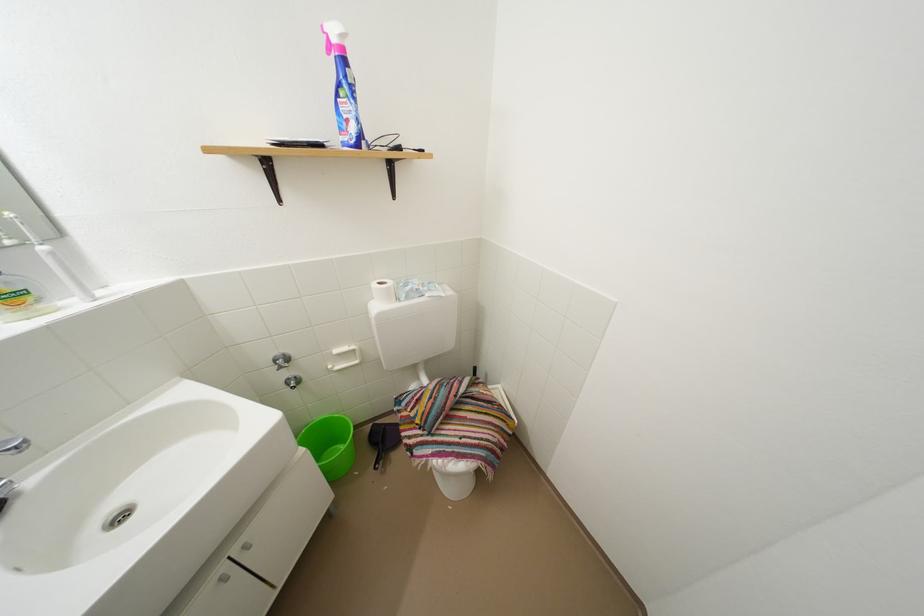
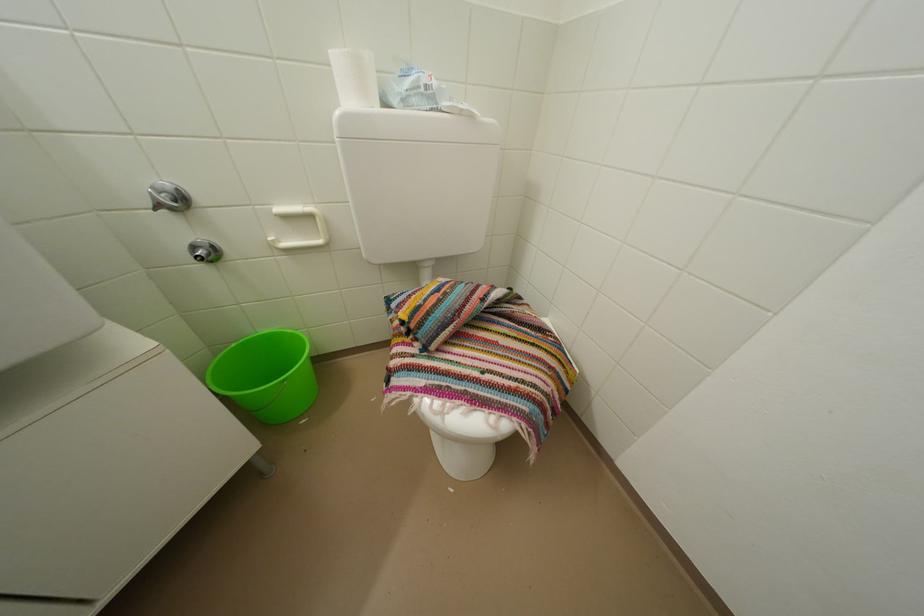
The point at (388, 289) is marked in the first image. Where is the corresponding point in the second image?

(359, 55)